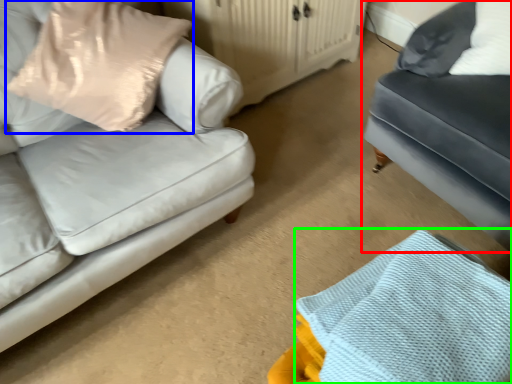
Question: Which object is positioned closest to studio couch (highlighted by a red box)? Select from pillow (highlighted by a blue box) and material (highlighted by a green box).

Choices:
 (A) pillow
 (B) material

Answer: (B)